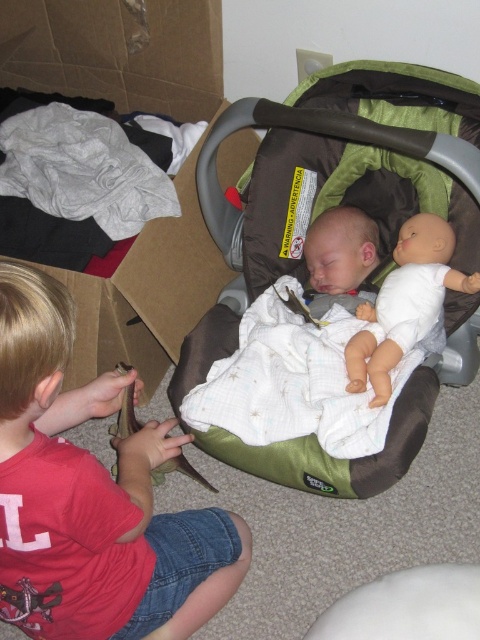
Question: Can you confirm if smooth red shirt at lower left is positioned to the right of gray cotton cloth at upper left?

Choices:
 (A) no
 (B) yes

Answer: (B)

Question: Which of the following is the closest to the observer?

Choices:
 (A) (184, 388)
 (B) (168, 333)

Answer: (A)

Question: Which point is closer to the camera taking this photo?

Choices:
 (A) (x=382, y=396)
 (B) (x=186, y=164)

Answer: (A)

Question: Is smooth red shirt at lower left behind gray cotton cloth at upper left?

Choices:
 (A) yes
 (B) no

Answer: (B)

Question: Does smooth red shirt at lower left have a smaller size compared to white matte baby doll at center?

Choices:
 (A) no
 (B) yes

Answer: (A)

Question: Which point is farther from the camera taking this photo?

Choices:
 (A) (108, 10)
 (B) (414, 276)

Answer: (A)